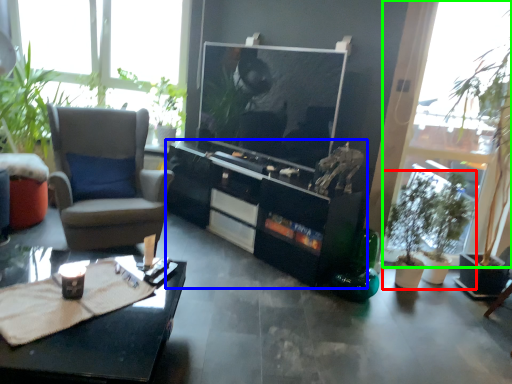
Question: Estimate the real-world distances between objects in this image. Which object is farther from houseplant (highlighted by a red box), cabinetry (highlighted by a blue box) or window (highlighted by a green box)?

Choices:
 (A) cabinetry
 (B) window

Answer: (A)